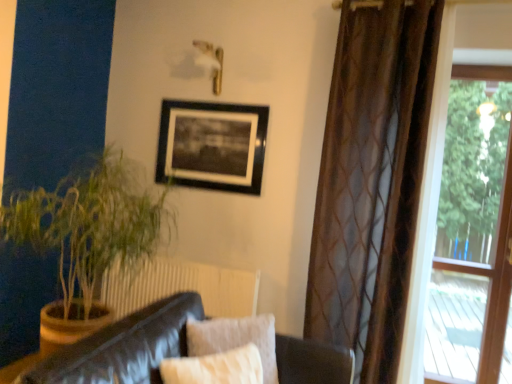
Question: Can you confirm if leather couch at lower left is smaller than brown sheer curtain at right?

Choices:
 (A) yes
 (B) no

Answer: (A)

Question: Is leather couch at lower left to the right of brown sheer curtain at right from the viewer's perspective?

Choices:
 (A) no
 (B) yes

Answer: (A)

Question: Is the depth of leather couch at lower left greater than that of brown sheer curtain at right?

Choices:
 (A) no
 (B) yes

Answer: (A)

Question: Is leather couch at lower left in contact with brown sheer curtain at right?

Choices:
 (A) yes
 (B) no

Answer: (B)

Question: Can you confirm if leather couch at lower left is taller than brown sheer curtain at right?

Choices:
 (A) no
 (B) yes

Answer: (A)

Question: Considering the positions of green leafy plant at left and leather couch at lower left in the image, is green leafy plant at left bigger or smaller than leather couch at lower left?

Choices:
 (A) big
 (B) small

Answer: (A)

Question: Considering the positions of green leafy plant at left and leather couch at lower left in the image, is green leafy plant at left wider or thinner than leather couch at lower left?

Choices:
 (A) wide
 (B) thin

Answer: (B)

Question: Is point (128, 210) closer or farther from the camera than point (179, 331)?

Choices:
 (A) farther
 (B) closer

Answer: (A)

Question: Is green leafy plant at left to the left or to the right of leather couch at lower left in the image?

Choices:
 (A) left
 (B) right

Answer: (A)

Question: Visually, is transparent glass window at right positioned to the left or to the right of leather couch at lower left?

Choices:
 (A) right
 (B) left

Answer: (A)

Question: From a real-world perspective, is transparent glass window at right positioned above or below leather couch at lower left?

Choices:
 (A) above
 (B) below

Answer: (A)

Question: Based on their sizes in the image, would you say transparent glass window at right is bigger or smaller than leather couch at lower left?

Choices:
 (A) big
 (B) small

Answer: (B)

Question: From the image's perspective, is transparent glass window at right located above or below leather couch at lower left?

Choices:
 (A) above
 (B) below

Answer: (A)

Question: In the image, is transparent glass window at right positioned in front of or behind black matte picture frame at upper center?

Choices:
 (A) front
 (B) behind

Answer: (A)

Question: From a real-world perspective, relative to black matte picture frame at upper center, is transparent glass window at right vertically above or below?

Choices:
 (A) above
 (B) below

Answer: (B)